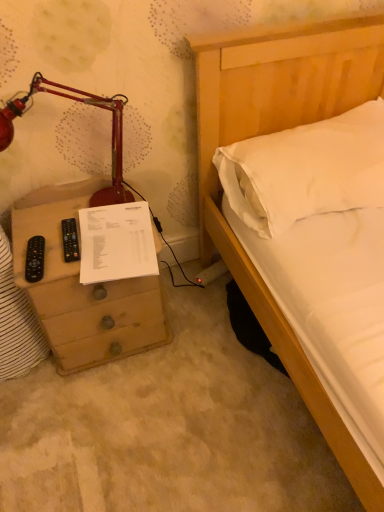
Identify the location of free location to the right of black plastic remote at left. (112, 245).